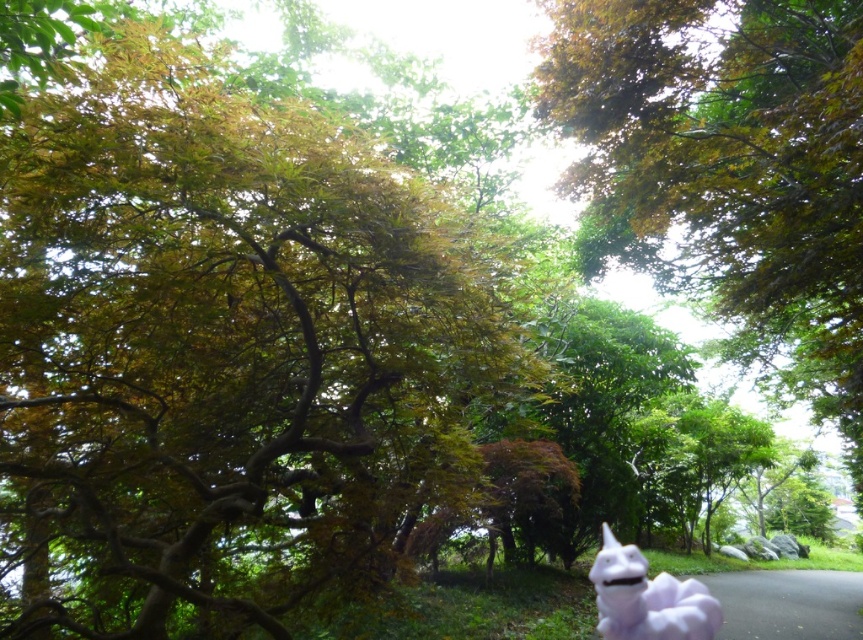
Is point (731, 628) more distant than point (635, 627)?

That is True.

Which is more to the right, purple fabric at lower right or white plush toy at lower right?

From the viewer's perspective, purple fabric at lower right appears more on the right side.

Who is more forward, (731, 611) or (660, 616)?

Positioned in front is point (660, 616).

You are a GUI agent. You are given a task and a screenshot of the screen. Output one action in this format:
    pyautogui.click(x=<x>, y=<y>)
    Task: Click on the purple fabric at lower right
    The width and height of the screenshot is (863, 640).
    Given the screenshot: What is the action you would take?
    pyautogui.click(x=786, y=604)

Which is in front, point (633, 115) or point (596, 561)?

Point (596, 561)

Who is more distant from viewer, (849, 188) or (602, 632)?

The point (849, 188) is behind.

Where is `green leafy tree at upper center`? The width and height of the screenshot is (863, 640). green leafy tree at upper center is located at coordinates (728, 170).

Where is `green leafy tree at upper center`? Image resolution: width=863 pixels, height=640 pixels. green leafy tree at upper center is located at coordinates (728, 170).

Does green leafy tree at upper center have a lesser width compared to purple fabric at lower right?

Indeed, green leafy tree at upper center has a lesser width compared to purple fabric at lower right.

Is green leafy tree at upper center bigger than purple fabric at lower right?

No, green leafy tree at upper center is not bigger than purple fabric at lower right.

Identify the location of green leafy tree at upper center. (728, 170).

You are a GUI agent. You are given a task and a screenshot of the screen. Output one action in this format:
    pyautogui.click(x=<x>, y=<y>)
    Task: Click on the green leafy tree at upper center
    This screenshot has width=863, height=640.
    Given the screenshot: What is the action you would take?
    pyautogui.click(x=728, y=170)